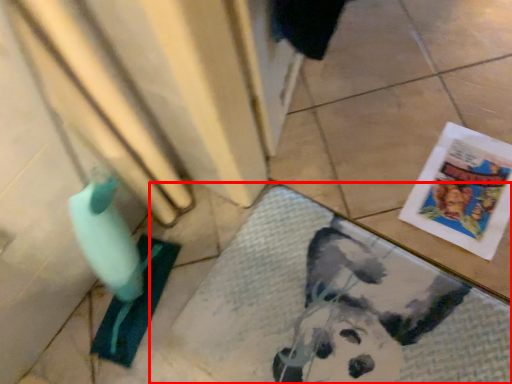
Question: Observing the image, what is the correct spatial positioning of bath mat (annotated by the red box) in reference to comic book?

Choices:
 (A) left
 (B) right

Answer: (A)